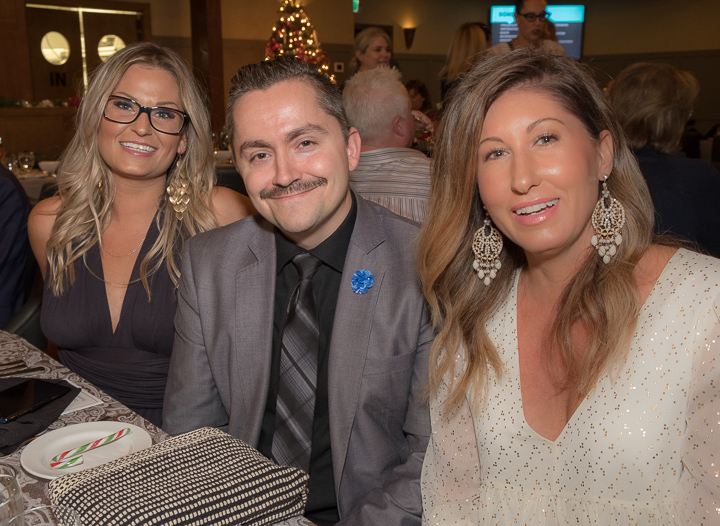
Find the location of `christmas lights`. christmas lights is located at coordinates (297, 44).